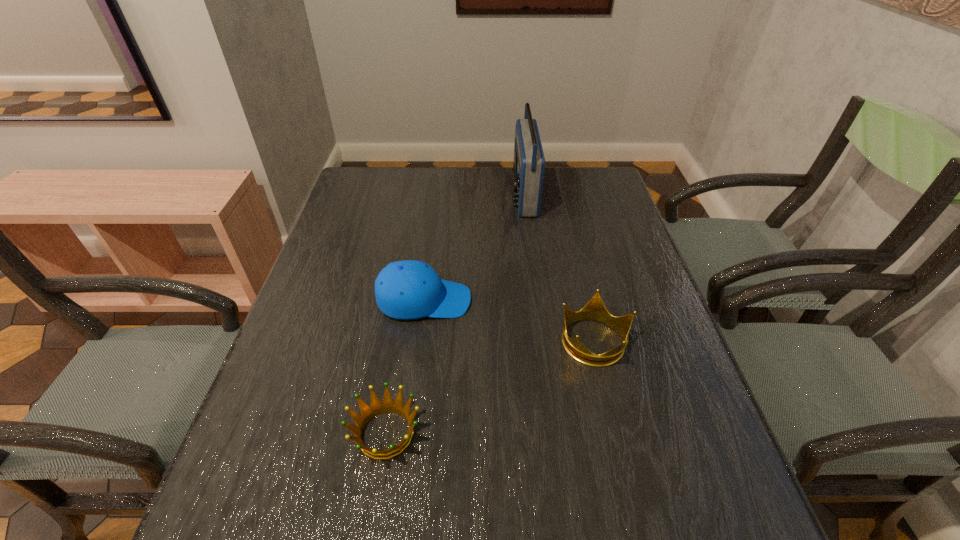
Identify the location of vacant region between the second shortest object and the shorter crown. This screenshot has height=540, width=960. (490, 387).

You are a GUI agent. You are given a task and a screenshot of the screen. Output one action in this format:
    pyautogui.click(x=<x>, y=<y>)
    Task: Click on the unoccupied position between the farther crown and the second tallest object
    This screenshot has width=960, height=540.
    Given the screenshot: What is the action you would take?
    pyautogui.click(x=509, y=320)

Locate an element on the screen. This screenshot has height=540, width=960. vacant space in between the third tallest object and the radio receiver is located at coordinates (559, 267).

Where is `object that stands as the third closest to the left crown`? object that stands as the third closest to the left crown is located at coordinates (529, 162).

Point out which object is positioned as the third nearest to the taller crown. Please provide its 2D coordinates. Your answer should be formatted as a tuple, i.e. [(x, y)], where the tuple contains the x and y coordinates of a point satisfying the conditions above.

[(529, 162)]

This screenshot has width=960, height=540. I want to click on free space that satisfies the following two spatial constraints: 1. on the front-facing side of the second shortest object; 2. on the left side of the cap, so click(419, 340).

Where is `free spot that satisfies the following two spatial constraints: 1. on the front-facing side of the cap; 2. on the front side of the nearer crown`? free spot that satisfies the following two spatial constraints: 1. on the front-facing side of the cap; 2. on the front side of the nearer crown is located at coordinates (407, 433).

Locate an element on the screen. vacant space that satisfies the following two spatial constraints: 1. on the front-facing side of the third shortest object; 2. on the back side of the taller crown is located at coordinates click(x=419, y=340).

Where is `free spot that satisfies the following two spatial constraints: 1. on the back side of the shortest object; 2. on the right side of the second shortest object`? Image resolution: width=960 pixels, height=540 pixels. free spot that satisfies the following two spatial constraints: 1. on the back side of the shortest object; 2. on the right side of the second shortest object is located at coordinates (401, 340).

At what (x,y) coordinates should I click in order to perform the action: click on free region that satisfies the following two spatial constraints: 1. on the front panel of the farther crown; 2. on the left side of the farthest object. Please return your answer as a coordinate pair (x, y). Looking at the image, I should click on (542, 340).